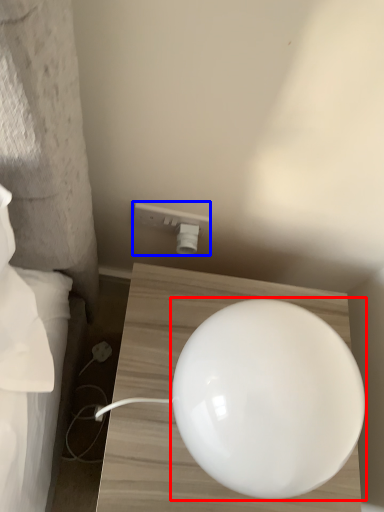
Question: Which point is further to the camera, lamp (highlighted by a red box) or electric outlet (highlighted by a blue box)?

Choices:
 (A) lamp
 (B) electric outlet

Answer: (B)